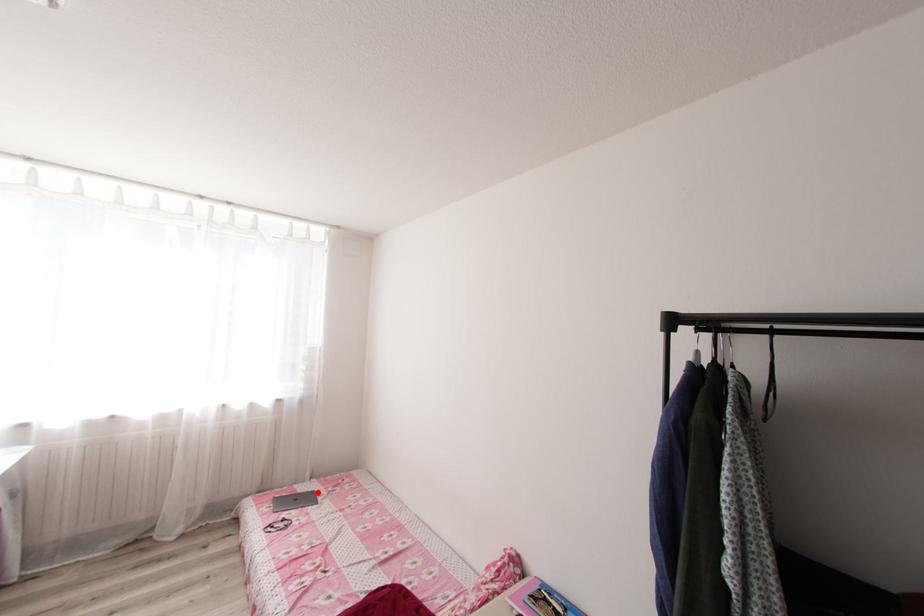
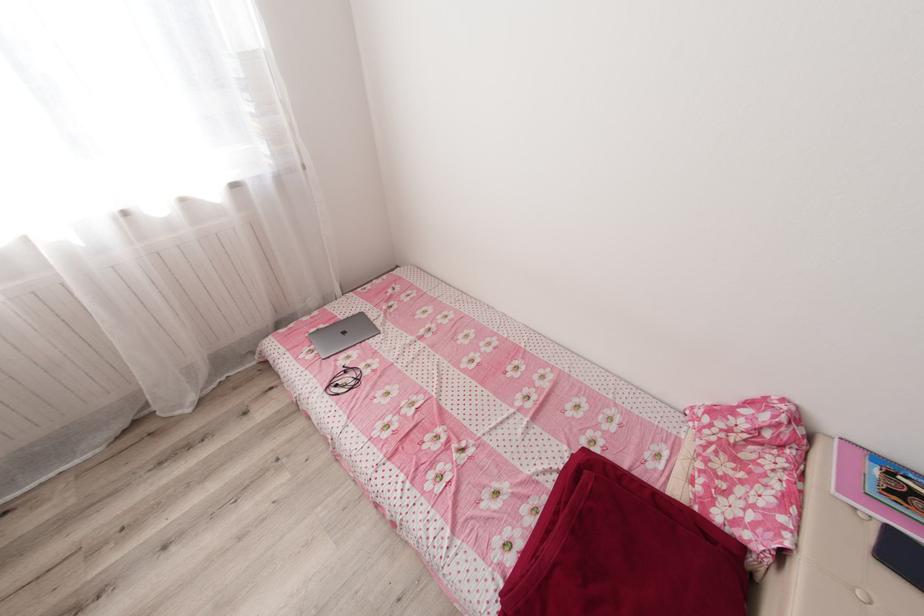
Question: I am providing you with two images of the same scene from different viewpoints. A red point is marked on the first image. At the location where the point appears in image 1, is it still visible in image 2?

Choices:
 (A) Yes
 (B) No

Answer: (A)